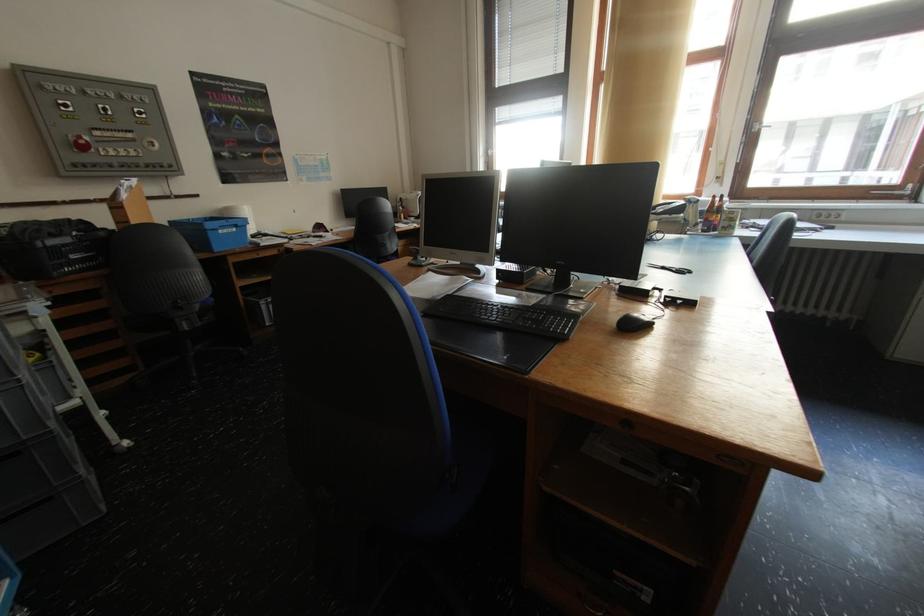
The image size is (924, 616). Identify the location of black chair sitting surface. (171, 328).